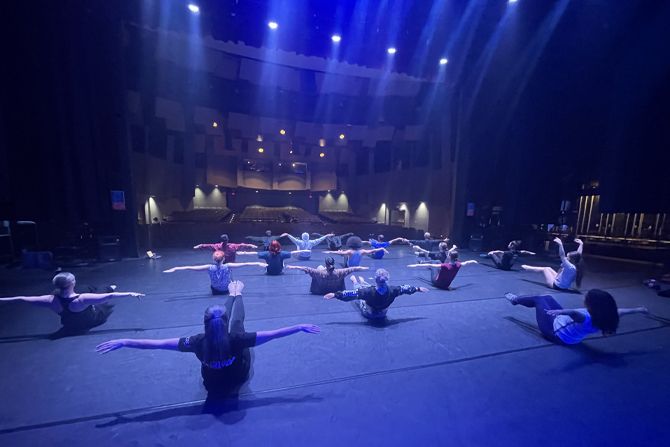
Find the location of a particular element. Image resolution: width=670 pixels, height=447 pixels. floor padding is located at coordinates (352, 360).